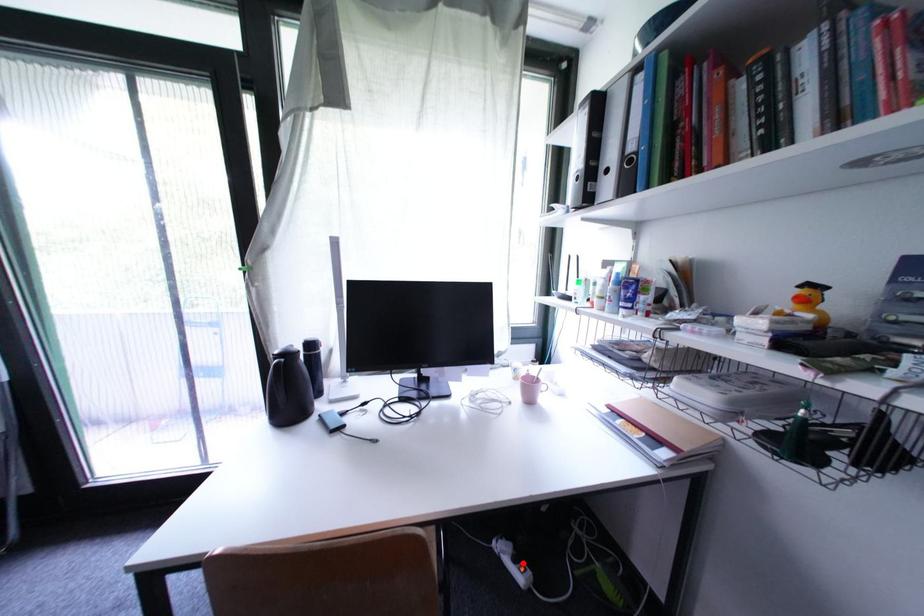
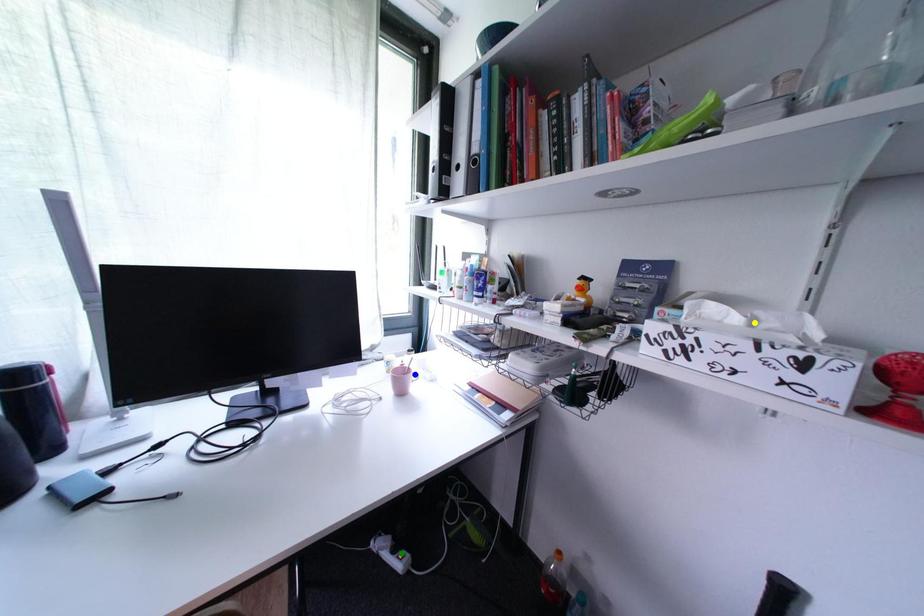
Question: I am providing you with two images of the same scene from different viewpoints. A red point is marked on the first image. You are given multiple points on the second image. Which point in image 2 is actually the same real-world point as the red point in image 1?

Choices:
 (A) yellow point
 (B) blue point
 (C) green point

Answer: (C)